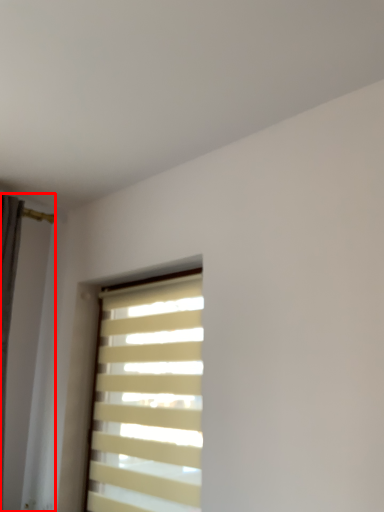
Question: From the image, what is the correct spatial relationship of shutter (annotated by the red box) in relation to window blind?

Choices:
 (A) left
 (B) right

Answer: (A)